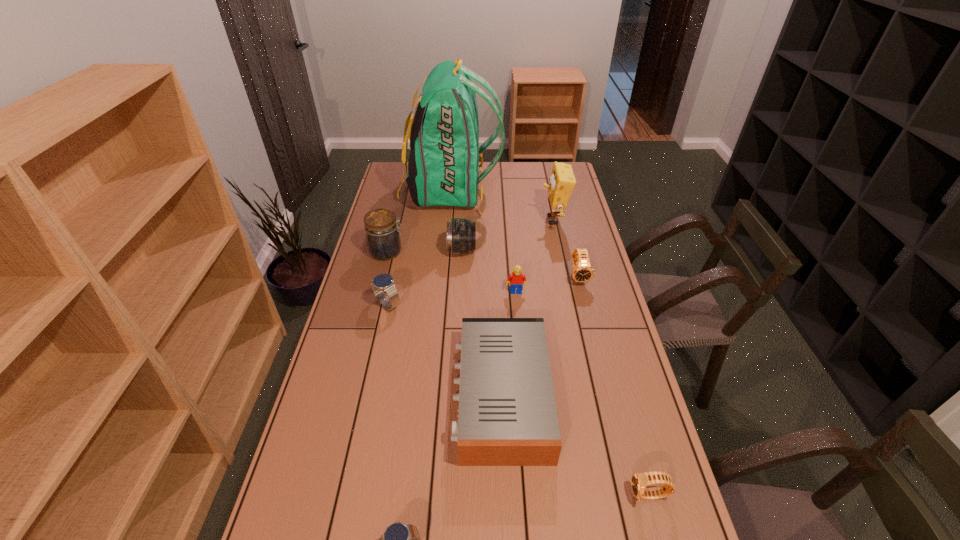
This screenshot has width=960, height=540. I want to click on free space located on the back of the left blue watch, so click(396, 266).

Identify the location of vacant space situated on the control panel of the third nearest object. The image size is (960, 540). (433, 395).

The width and height of the screenshot is (960, 540). Find the location of `vacant position located 0.220m on the control panel of the third nearest object`. vacant position located 0.220m on the control panel of the third nearest object is located at coordinates (376, 395).

Identify the location of vacant region located 0.080m on the control panel of the third nearest object. (425, 395).

Locate an element on the screen. The width and height of the screenshot is (960, 540). vacant area located 0.270m on the face of the ninth farthest object is located at coordinates (517, 495).

Locate an element on the screen. This screenshot has width=960, height=540. free space located 0.260m on the face of the ninth farthest object is located at coordinates (522, 495).

Where is `vacant point located on the face of the ninth farthest object`? The image size is (960, 540). vacant point located on the face of the ninth farthest object is located at coordinates (489, 495).

This screenshot has height=540, width=960. Find the location of `object at the far edge`. object at the far edge is located at coordinates (443, 167).

You are a GUI agent. You are given a task and a screenshot of the screen. Output one action in this format:
    pyautogui.click(x=<x>, y=<y>)
    Task: Click on the backpack positioned at the left edge
    The image size is (960, 540).
    Given the screenshot: What is the action you would take?
    pyautogui.click(x=443, y=167)

The height and width of the screenshot is (540, 960). In order to click on jar that is at the left edge in this screenshot , I will do `click(382, 231)`.